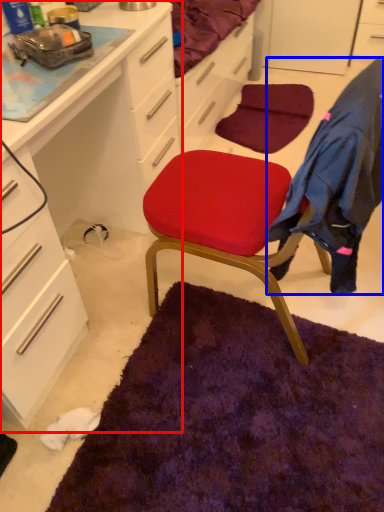
Question: Which point is closer to the camera, cabinetry (highlighted by a red box) or clothing (highlighted by a blue box)?

Choices:
 (A) cabinetry
 (B) clothing

Answer: (A)